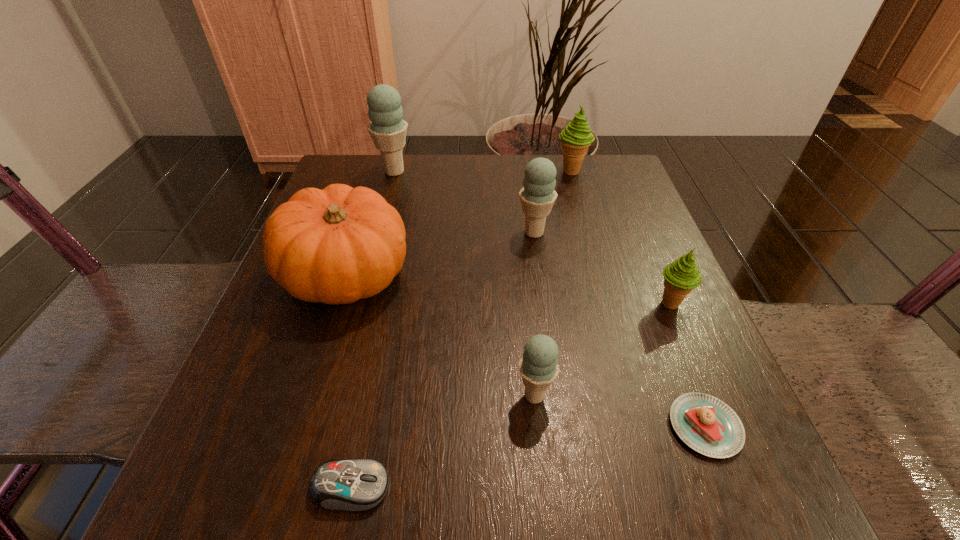
Where is `unoccupied position between the tallest object and the computer mouse`? unoccupied position between the tallest object and the computer mouse is located at coordinates (372, 329).

Where is `free space between the smallest blue ice cream and the pastry`? This screenshot has height=540, width=960. free space between the smallest blue ice cream and the pastry is located at coordinates (620, 411).

Locate an element on the screen. This screenshot has width=960, height=540. free area in between the nearest blue ice cream and the second nearest blue ice cream is located at coordinates (x=535, y=314).

Locate an element on the screen. The width and height of the screenshot is (960, 540). unoccupied position between the leftmost ice cream and the shortest object is located at coordinates (550, 299).

The width and height of the screenshot is (960, 540). I want to click on object identified as the closest to the biggest blue ice cream, so click(x=337, y=245).

Identify which object is the seventh closest to the pumpkin. Please provide its 2D coordinates. Your answer should be formatted as a tuple, i.e. [(x, y)], where the tuple contains the x and y coordinates of a point satisfying the conditions above.

[(681, 276)]

Choose which ice cream is the third nearest neighbor to the nearest blue ice cream. Please provide its 2D coordinates. Your answer should be formatted as a tuple, i.e. [(x, y)], where the tuple contains the x and y coordinates of a point satisfying the conditions above.

[(576, 138)]

Locate which ice cream is the second closest to the farther green icecream. Please provide its 2D coordinates. Your answer should be formatted as a tuple, i.e. [(x, y)], where the tuple contains the x and y coordinates of a point satisfying the conditions above.

[(388, 130)]

Identify the location of the closest blue ice cream to the nearer green icecream. This screenshot has height=540, width=960. (537, 196).

Locate an element on the screen. The width and height of the screenshot is (960, 540). blue ice cream identified as the second closest to the bigger green icecream is located at coordinates (388, 130).